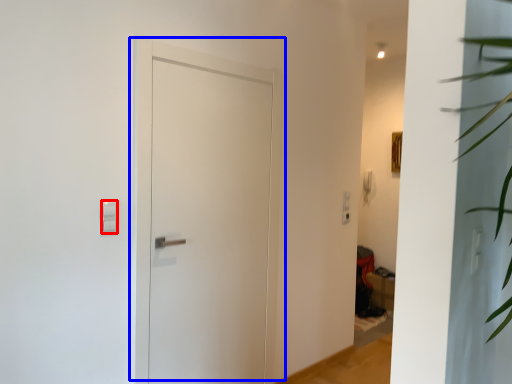
Question: Which point is further to the camera, light switch (highlighted by a red box) or door (highlighted by a blue box)?

Choices:
 (A) light switch
 (B) door

Answer: (B)